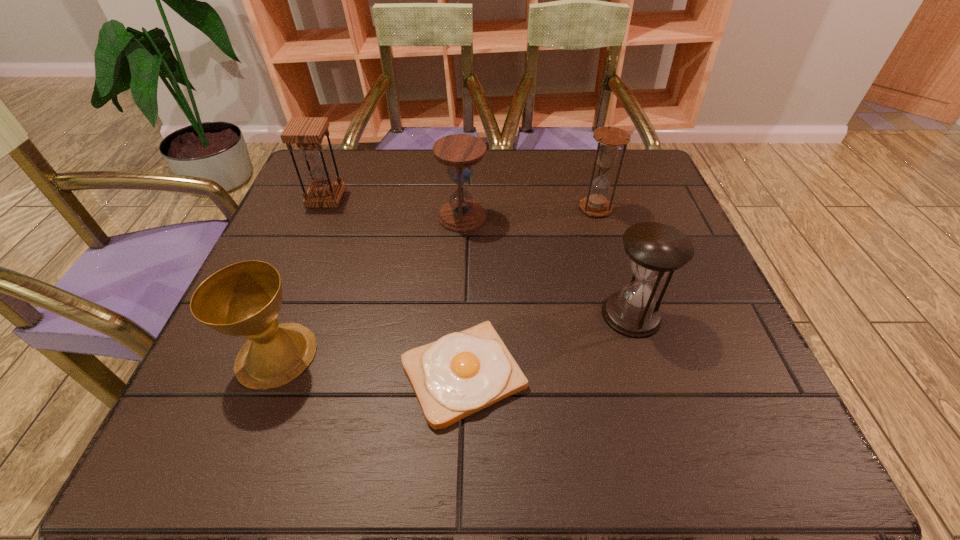
You are a GUI agent. You are given a task and a screenshot of the screen. Output one action in this format:
    pyautogui.click(x=<x>, y=<y>)
    Task: Click on the hourglass that is the closest to the second hourglass from left to right
    
    Given the screenshot: What is the action you would take?
    pyautogui.click(x=609, y=139)

The width and height of the screenshot is (960, 540). Find the location of `free space that satisfies the following two spatial constraints: 1. on the back side of the chalice; 2. on the left side of the nearest hourglass`. free space that satisfies the following two spatial constraints: 1. on the back side of the chalice; 2. on the left side of the nearest hourglass is located at coordinates (292, 315).

This screenshot has height=540, width=960. In order to click on vacant space that satisfies the following two spatial constraints: 1. on the front side of the leftmost hourglass; 2. on the left side of the chalice in this screenshot , I will do `click(262, 355)`.

I want to click on vacant space that satisfies the following two spatial constraints: 1. on the front side of the chalice; 2. on the left side of the leftmost hourglass, so click(x=262, y=355).